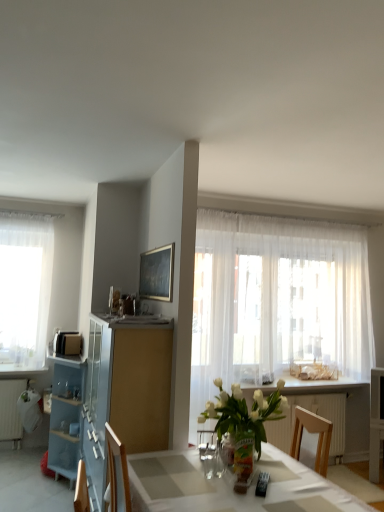
Question: Is sheer white curtain at right, the first curtain positioned from the right, taller than white glossy counter top at center?

Choices:
 (A) yes
 (B) no

Answer: (A)

Question: Is sheer white curtain at right, which is the 2th curtain in left-to-right order, outside white glossy counter top at center?

Choices:
 (A) no
 (B) yes

Answer: (B)

Question: Does sheer white curtain at right, which is the 2th curtain in left-to-right order, appear on the left side of white glossy counter top at center?

Choices:
 (A) yes
 (B) no

Answer: (B)

Question: Is sheer white curtain at right, the first curtain positioned from the right, behind white glossy counter top at center?

Choices:
 (A) yes
 (B) no

Answer: (B)

Question: Does sheer white curtain at right, which is the 2th curtain in left-to-right order, turn towards white glossy counter top at center?

Choices:
 (A) yes
 (B) no

Answer: (B)

Question: In terms of height, does blue glass cabinet at left look taller or shorter compared to clear glass vase at center?

Choices:
 (A) short
 (B) tall

Answer: (B)

Question: From a real-world perspective, relative to clear glass vase at center, is blue glass cabinet at left vertically above or below?

Choices:
 (A) below
 (B) above

Answer: (A)

Question: Considering the positions of blue glass cabinet at left and clear glass vase at center in the image, is blue glass cabinet at left wider or thinner than clear glass vase at center?

Choices:
 (A) wide
 (B) thin

Answer: (A)

Question: Is blue glass cabinet at left situated inside clear glass vase at center or outside?

Choices:
 (A) outside
 (B) inside

Answer: (A)

Question: Which is correct: white glossy counter top at center is inside matte black microwave at left, or outside of it?

Choices:
 (A) inside
 (B) outside

Answer: (B)

Question: Relative to matte black microwave at left, is white glossy counter top at center in front or behind?

Choices:
 (A) behind
 (B) front

Answer: (B)

Question: In terms of width, does white glossy counter top at center look wider or thinner when compared to matte black microwave at left?

Choices:
 (A) thin
 (B) wide

Answer: (B)

Question: Is point (246, 385) positioned closer to the camera than point (61, 343)?

Choices:
 (A) closer
 (B) farther

Answer: (A)

Question: Is white glossy counter top at center taller or shorter than clear glass vase at center?

Choices:
 (A) tall
 (B) short

Answer: (B)

Question: In terms of size, does white glossy counter top at center appear bigger or smaller than clear glass vase at center?

Choices:
 (A) small
 (B) big

Answer: (B)